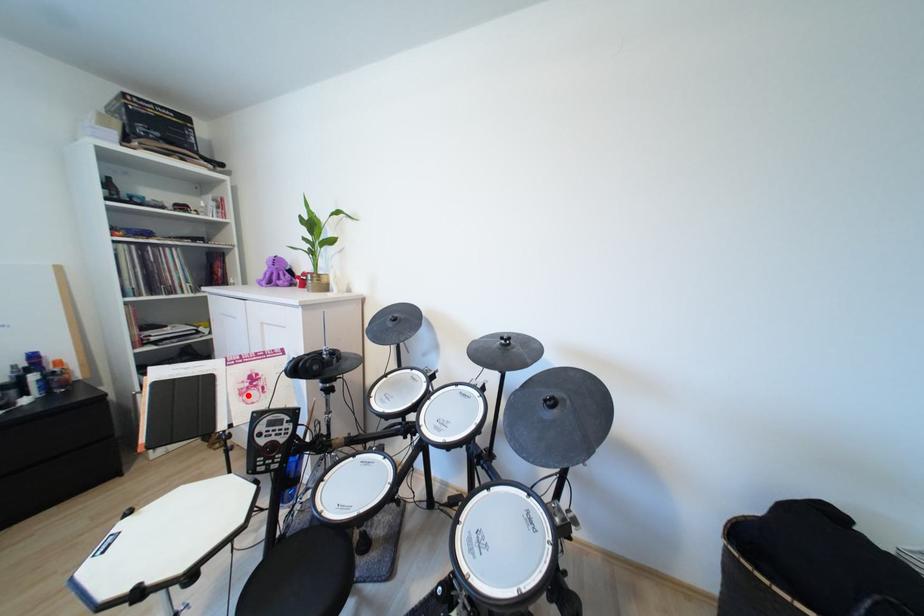
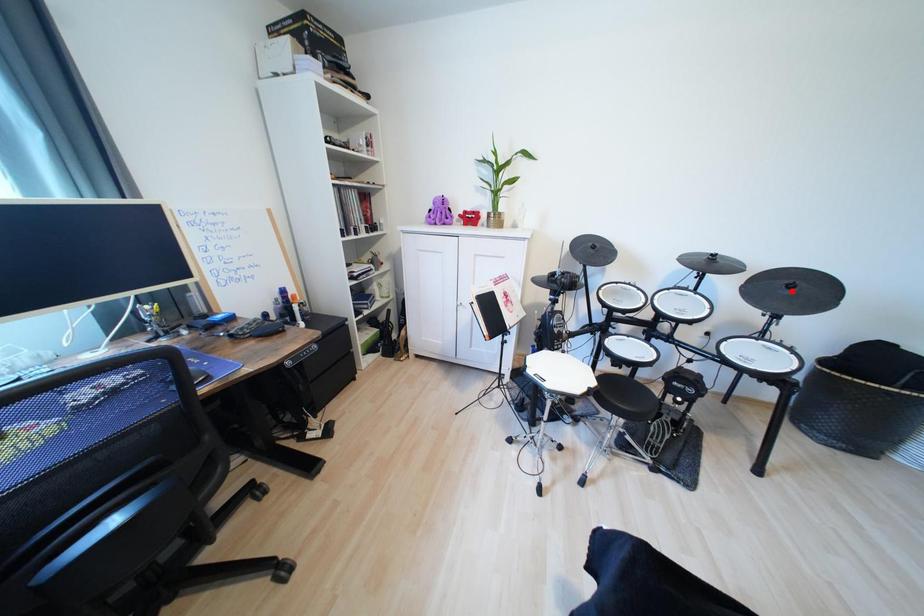
I am providing you with two images of the same scene from different viewpoints. A red point is marked on the first image and another point is marked on the second image. Does the point marked in image1 correspond to the same location as the one in image2?

No